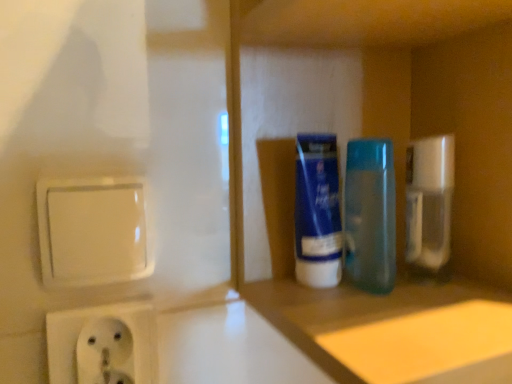
Describe the element at coordinates (317, 212) in the screenshot. I see `blue glossy tube at center, which is the 2th mouthwash in right-to-left order` at that location.

You are a GUI agent. You are given a task and a screenshot of the screen. Output one action in this format:
    pyautogui.click(x=<x>, y=<y>)
    Task: Click on the clear plastic spray bottle at right
    
    Given the screenshot: What is the action you would take?
    pyautogui.click(x=429, y=202)

What do you see at coordinates (429, 202) in the screenshot?
I see `clear plastic spray bottle at right` at bounding box center [429, 202].

Where is `blue plastic bottles at center`? This screenshot has width=512, height=384. blue plastic bottles at center is located at coordinates (393, 172).

Find the location of a particular element. This screenshot has height=384, width=512. blue glossy tube at center, which is the 2th mouthwash in right-to-left order is located at coordinates (317, 212).

The width and height of the screenshot is (512, 384). Identify the location of the 1st mouthwash behind the white plastic socket at lower left, counting from the anchor's position. (317, 212).

Considering the sizes of white plastic socket at lower left and blue glossy tube at center, which appears as the 1th mouthwash when viewed from the left, in the image, is white plastic socket at lower left wider or thinner than blue glossy tube at center, which appears as the 1th mouthwash when viewed from the left,?

Clearly, white plastic socket at lower left has less width compared to blue glossy tube at center, which appears as the 1th mouthwash when viewed from the left.

Is point (117, 364) positioned in front of point (335, 246)?

Yes, point (117, 364) is in front of point (335, 246).

Which object is closer to the camera taking this photo, white plastic socket at lower left or blue glossy tube at center, which is the 2th mouthwash in right-to-left order?

white plastic socket at lower left is in front.

Is clear plastic spray bottle at right outside of blue translucent bottle at center, the second mouthwash positioned from the left?

clear plastic spray bottle at right is positioned outside blue translucent bottle at center, the second mouthwash positioned from the left.

Can you confirm if clear plastic spray bottle at right is thinner than blue translucent bottle at center, the 1th mouthwash positioned from the right?

Indeed, clear plastic spray bottle at right has a lesser width compared to blue translucent bottle at center, the 1th mouthwash positioned from the right.

Which is behind, clear plastic spray bottle at right or blue translucent bottle at center, the second mouthwash positioned from the left?

clear plastic spray bottle at right is behind.

Is the depth of blue translucent bottle at center, the second mouthwash positioned from the left, greater than that of white plastic socket at lower left?

Yes, it is.

Considering the relative sizes of blue translucent bottle at center, the second mouthwash positioned from the left, and white plastic socket at lower left in the image provided, is blue translucent bottle at center, the second mouthwash positioned from the left, bigger than white plastic socket at lower left?

Correct, blue translucent bottle at center, the second mouthwash positioned from the left, is larger in size than white plastic socket at lower left.

Considering the relative sizes of blue translucent bottle at center, the second mouthwash positioned from the left, and white plastic socket at lower left in the image provided, is blue translucent bottle at center, the second mouthwash positioned from the left, wider than white plastic socket at lower left?

Correct, the width of blue translucent bottle at center, the second mouthwash positioned from the left, exceeds that of white plastic socket at lower left.

Which is farther from the camera, (377,270) or (63,372)?

Positioned behind is point (377,270).

Is point (420, 213) behind point (434, 336)?

Yes.

Can you confirm if clear plastic spray bottle at right is wider than blue plastic bottles at center?

No.

Would you say clear plastic spray bottle at right is outside blue plastic bottles at center?

No.

Is clear plastic spray bottle at right completely or partially outside of blue glossy tube at center, which appears as the 1th mouthwash when viewed from the left?

Yes, clear plastic spray bottle at right is outside of blue glossy tube at center, which appears as the 1th mouthwash when viewed from the left.

Is clear plastic spray bottle at right facing towards blue glossy tube at center, which is the 2th mouthwash in right-to-left order?

No.

Does clear plastic spray bottle at right have a greater width compared to blue glossy tube at center, which is the 2th mouthwash in right-to-left order?

Indeed, clear plastic spray bottle at right has a greater width compared to blue glossy tube at center, which is the 2th mouthwash in right-to-left order.

Is clear plastic spray bottle at right far from blue glossy tube at center, which appears as the 1th mouthwash when viewed from the left?

clear plastic spray bottle at right is actually quite close to blue glossy tube at center, which appears as the 1th mouthwash when viewed from the left.

From the picture: Is there a large distance between white plastic socket at lower left and blue plastic bottles at center?

white plastic socket at lower left is actually quite close to blue plastic bottles at center.

Is white plastic socket at lower left oriented away from blue plastic bottles at center?

No, white plastic socket at lower left is not facing away from blue plastic bottles at center.

In the scene shown: From the image's perspective, who appears lower, white plastic socket at lower left or blue plastic bottles at center?

white plastic socket at lower left.

From a real-world perspective, which is physically above, blue glossy tube at center, which is the 2th mouthwash in right-to-left order, or blue translucent bottle at center, the 1th mouthwash positioned from the right?

In real-world perspective, blue translucent bottle at center, the 1th mouthwash positioned from the right, is above.

Which of these two, blue glossy tube at center, which is the 2th mouthwash in right-to-left order, or blue translucent bottle at center, the 1th mouthwash positioned from the right, stands shorter?

blue glossy tube at center, which is the 2th mouthwash in right-to-left order.

Between blue glossy tube at center, which appears as the 1th mouthwash when viewed from the left, and blue translucent bottle at center, the second mouthwash positioned from the left, which one has larger size?

Bigger between the two is blue translucent bottle at center, the second mouthwash positioned from the left.

Starting from the white plastic socket at lower left, which mouthwash is the 1st one to the right? Please provide its 2D coordinates.

[(317, 212)]

The height and width of the screenshot is (384, 512). Find the location of `the 1st mouthwash counting from the left side of the clear plastic spray bottle at right`. the 1st mouthwash counting from the left side of the clear plastic spray bottle at right is located at coordinates (370, 215).

Looking at the image, which one is located closer to blue translucent bottle at center, the 1th mouthwash positioned from the right, white plastic socket at lower left or blue plastic bottles at center?

blue plastic bottles at center lies closer to blue translucent bottle at center, the 1th mouthwash positioned from the right, than the other object.

Based on their spatial positions, is blue translucent bottle at center, the 1th mouthwash positioned from the right, or blue plastic bottles at center closer to clear plastic spray bottle at right?

Based on the image, blue translucent bottle at center, the 1th mouthwash positioned from the right, appears to be nearer to clear plastic spray bottle at right.

Which object lies further to the anchor point blue glossy tube at center, which is the 2th mouthwash in right-to-left order, white plastic socket at lower left or blue plastic bottles at center?

Among the two, white plastic socket at lower left is located further to blue glossy tube at center, which is the 2th mouthwash in right-to-left order.

Considering their positions, is blue translucent bottle at center, the 1th mouthwash positioned from the right, positioned closer to blue glossy tube at center, which appears as the 1th mouthwash when viewed from the left, than white plastic socket at lower left?

blue translucent bottle at center, the 1th mouthwash positioned from the right, is closer to blue glossy tube at center, which appears as the 1th mouthwash when viewed from the left.

Looking at this image, considering their positions, is blue translucent bottle at center, the 1th mouthwash positioned from the right, positioned closer to blue glossy tube at center, which is the 2th mouthwash in right-to-left order, than blue plastic bottles at center?

The object closer to blue glossy tube at center, which is the 2th mouthwash in right-to-left order, is blue translucent bottle at center, the 1th mouthwash positioned from the right.

In the scene shown: Looking at the image, which one is located closer to blue plastic bottles at center, clear plastic spray bottle at right or white plastic socket at lower left?

clear plastic spray bottle at right is closer to blue plastic bottles at center.

Which object lies further to the anchor point white plastic socket at lower left, blue translucent bottle at center, the 1th mouthwash positioned from the right, or clear plastic spray bottle at right?

The object further to white plastic socket at lower left is clear plastic spray bottle at right.

Looking at the image, which one is located further to clear plastic spray bottle at right, white plastic socket at lower left or blue translucent bottle at center, the 1th mouthwash positioned from the right?

white plastic socket at lower left lies further to clear plastic spray bottle at right than the other object.

Where is `mouthwash between blue glossy tube at center, which appears as the 1th mouthwash when viewed from the left, and clear plastic spray bottle at right, in the horizontal direction`? The image size is (512, 384). mouthwash between blue glossy tube at center, which appears as the 1th mouthwash when viewed from the left, and clear plastic spray bottle at right, in the horizontal direction is located at coordinates (370, 215).

Locate an element on the screen. This screenshot has height=384, width=512. mouthwash situated between white plastic socket at lower left and blue translucent bottle at center, the second mouthwash positioned from the left, from left to right is located at coordinates (317, 212).

The height and width of the screenshot is (384, 512). In order to click on mouthwash between blue plastic bottles at center and blue translucent bottle at center, the 1th mouthwash positioned from the right, from front to back in this screenshot , I will do click(317, 212).

This screenshot has height=384, width=512. In order to click on cabinet between white plastic socket at lower left and clear plastic spray bottle at right from left to right in this screenshot , I will do `click(393, 172)`.